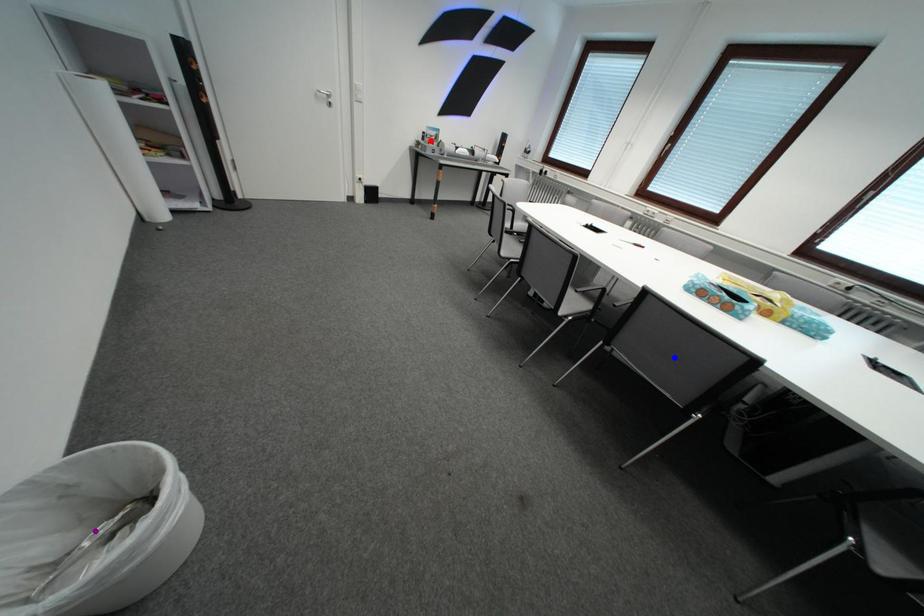
Order these from farthest to nearest:
red point
purple point
blue point

red point → blue point → purple point